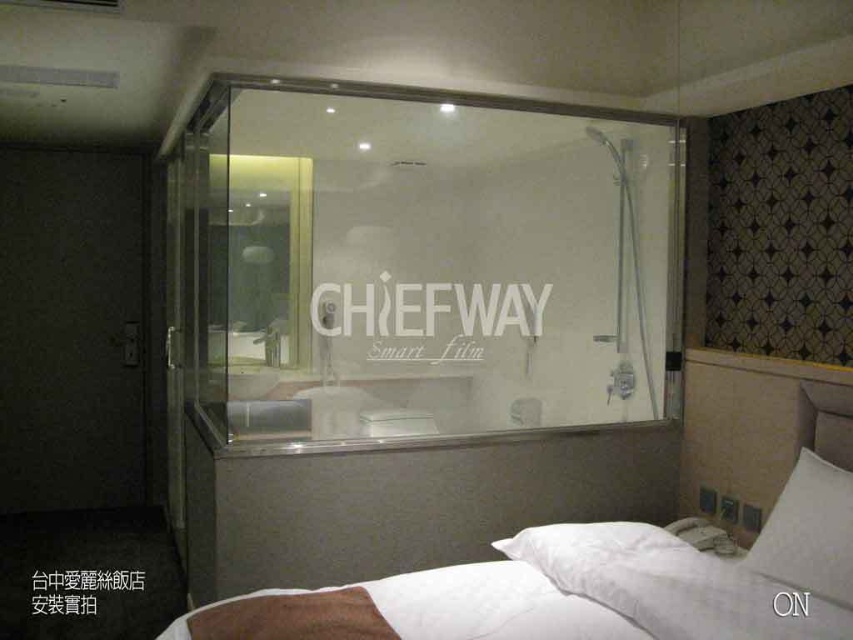
Question: Which point is closer to the camera?

Choices:
 (A) white soft bed at center
 (B) matte black door at left
 (C) transparent glass shower at center
 (D) white soft pillow at lower right

Answer: (A)

Question: Is transparent glass shower at center closer to camera compared to matte black door at left?

Choices:
 (A) no
 (B) yes

Answer: (B)

Question: Does transparent glass shower at center have a larger size compared to matte black door at left?

Choices:
 (A) yes
 (B) no

Answer: (A)

Question: Considering the relative positions of white soft bed at center and white soft pillow at lower right in the image provided, where is white soft bed at center located with respect to white soft pillow at lower right?

Choices:
 (A) left
 (B) right

Answer: (A)

Question: Which point is farther to the camera?

Choices:
 (A) (641, 634)
 (B) (578, 140)
 (C) (1, 307)

Answer: (C)

Question: Which point is farther to the camera?

Choices:
 (A) transparent glass shower at center
 (B) matte black door at left
 (C) white soft bed at center
 (D) white soft pillow at lower right

Answer: (B)